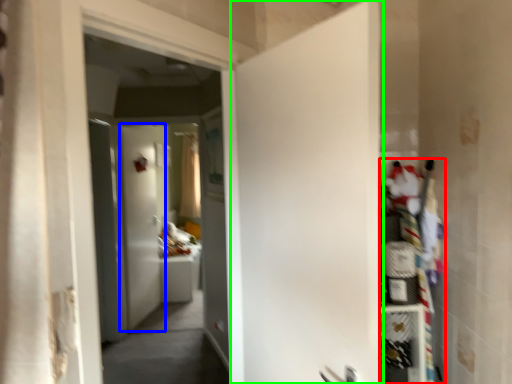
Question: Which object is the farthest from shelf (highlighted by a red box)? Choose among these: door (highlighted by a blue box) or door (highlighted by a green box).

Choices:
 (A) door
 (B) door

Answer: (A)